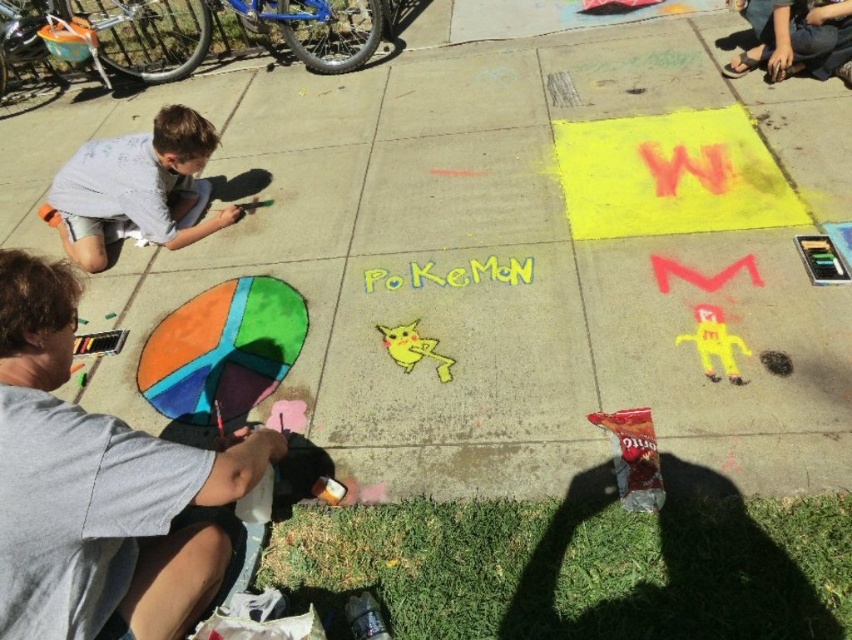
Question: Is smooth gray shirt at lower left further to camera compared to light gray shirt at upper left?

Choices:
 (A) yes
 (B) no

Answer: (B)

Question: Considering the relative positions of smooth gray shirt at lower left and light gray shirt at upper left in the image provided, where is smooth gray shirt at lower left located with respect to light gray shirt at upper left?

Choices:
 (A) below
 (B) above

Answer: (A)

Question: Does smooth gray shirt at lower left appear over light gray shirt at upper left?

Choices:
 (A) yes
 (B) no

Answer: (B)

Question: Which of the following is the closest to the observer?

Choices:
 (A) (139, 166)
 (B) (137, 472)

Answer: (B)